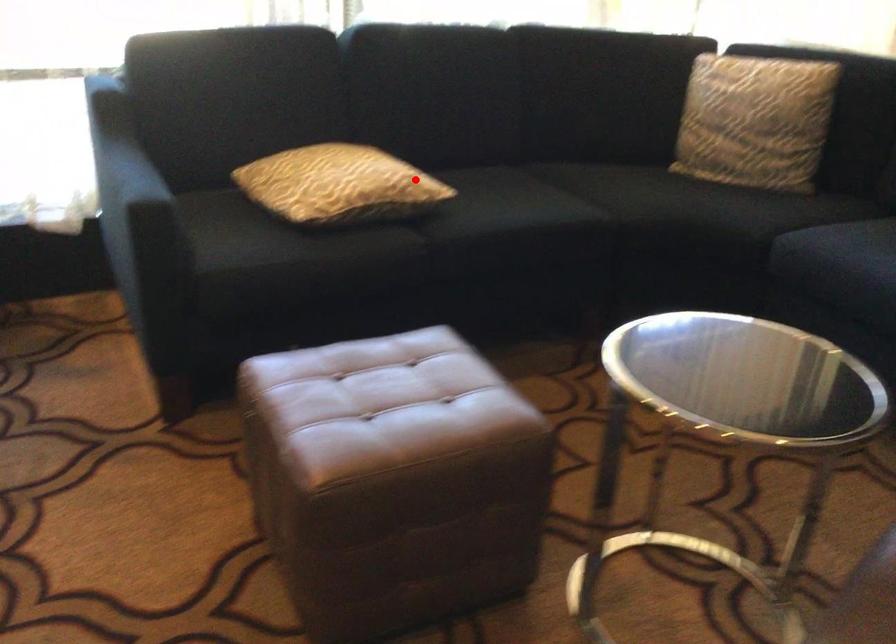
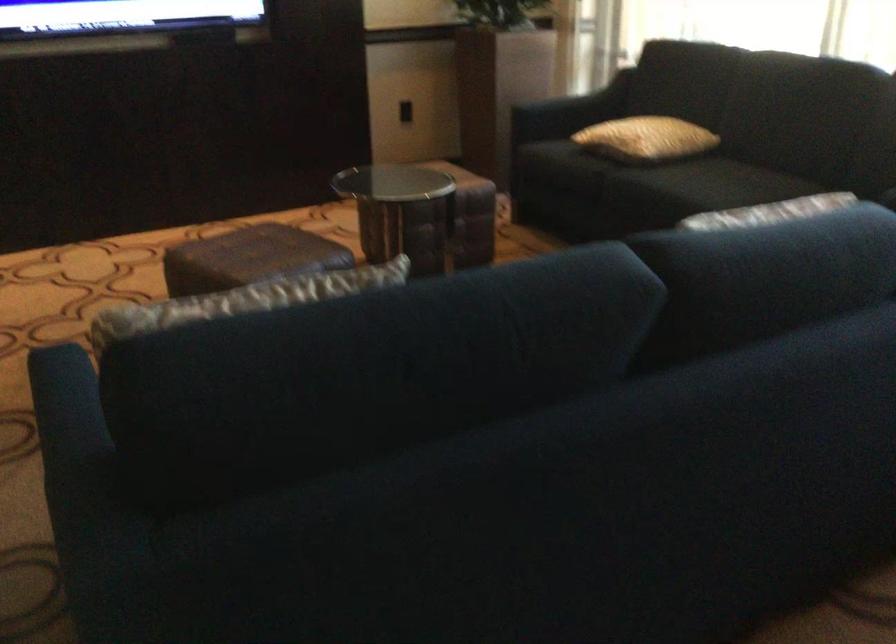
In the second image, find the point that corresponds to the highlighted location in the first image.

(645, 138)